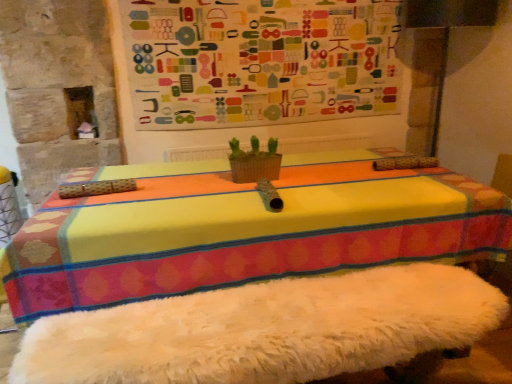
Question: Does woven basket at center appear on the left side of multicolored fabric bulletin board at upper center?

Choices:
 (A) yes
 (B) no

Answer: (A)

Question: Does woven basket at center have a greater height compared to multicolored fabric bulletin board at upper center?

Choices:
 (A) yes
 (B) no

Answer: (B)

Question: Can we say woven basket at center lies outside multicolored fabric bulletin board at upper center?

Choices:
 (A) no
 (B) yes

Answer: (B)

Question: Is woven basket at center bigger than multicolored fabric bulletin board at upper center?

Choices:
 (A) yes
 (B) no

Answer: (B)

Question: Can you confirm if woven basket at center is wider than multicolored fabric bulletin board at upper center?

Choices:
 (A) no
 (B) yes

Answer: (B)

Question: Is woven basket at center facing towards multicolored fabric bulletin board at upper center?

Choices:
 (A) yes
 (B) no

Answer: (B)

Question: Can you confirm if multicolored fabric bulletin board at upper center is shorter than woven basket at center?

Choices:
 (A) no
 (B) yes

Answer: (A)

Question: Could you tell me if multicolored fabric bulletin board at upper center is turned towards woven basket at center?

Choices:
 (A) no
 (B) yes

Answer: (B)

Question: Does multicolored fabric bulletin board at upper center have a larger size compared to woven basket at center?

Choices:
 (A) yes
 (B) no

Answer: (A)

Question: Is woven basket at center located within multicolored fabric bulletin board at upper center?

Choices:
 (A) no
 (B) yes

Answer: (A)

Question: Can we say multicolored fabric bulletin board at upper center lies outside woven basket at center?

Choices:
 (A) yes
 (B) no

Answer: (A)

Question: From the image's perspective, is multicolored fabric bulletin board at upper center located beneath woven basket at center?

Choices:
 (A) yes
 (B) no

Answer: (B)

Question: Is multicolored fabric bulletin board at upper center inside or outside of woven basket at center?

Choices:
 (A) outside
 (B) inside

Answer: (A)